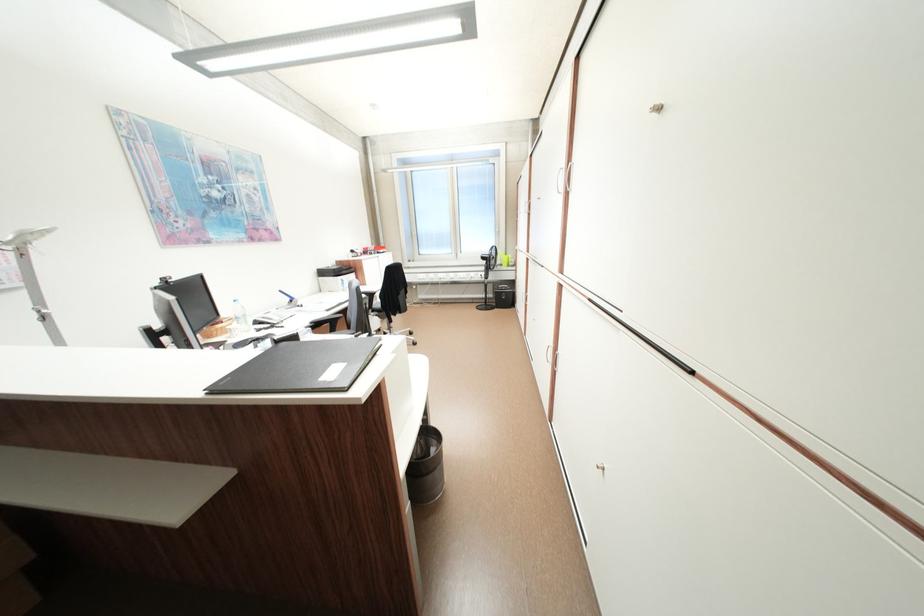
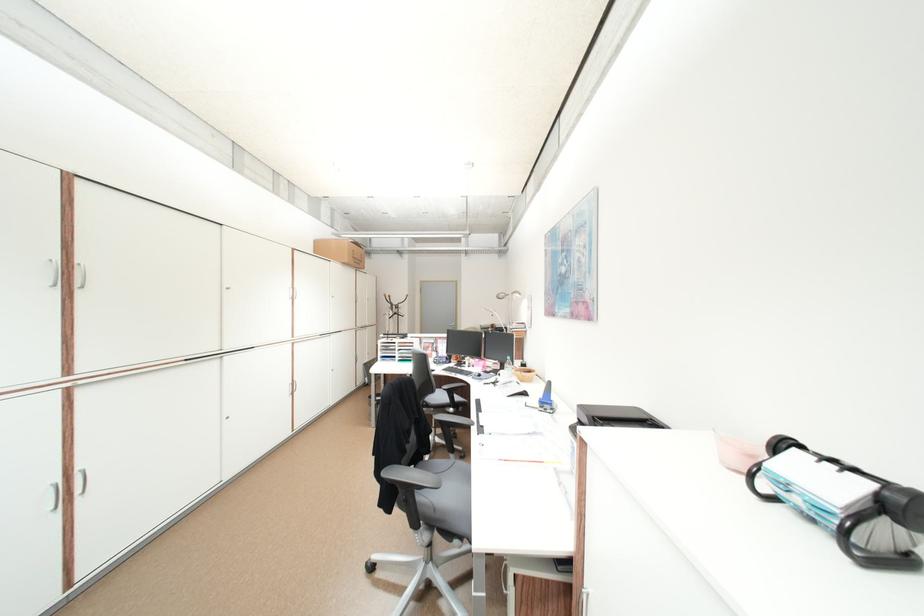
Question: I am providing you with two images of the same scene from different viewpoints. Which of the following objects are not visible in image2?

Choices:
 (A) chair sitting surface
 (B) card file knob
 (C) plastic water bottle
 (D) white dropper bottle

Answer: (A)